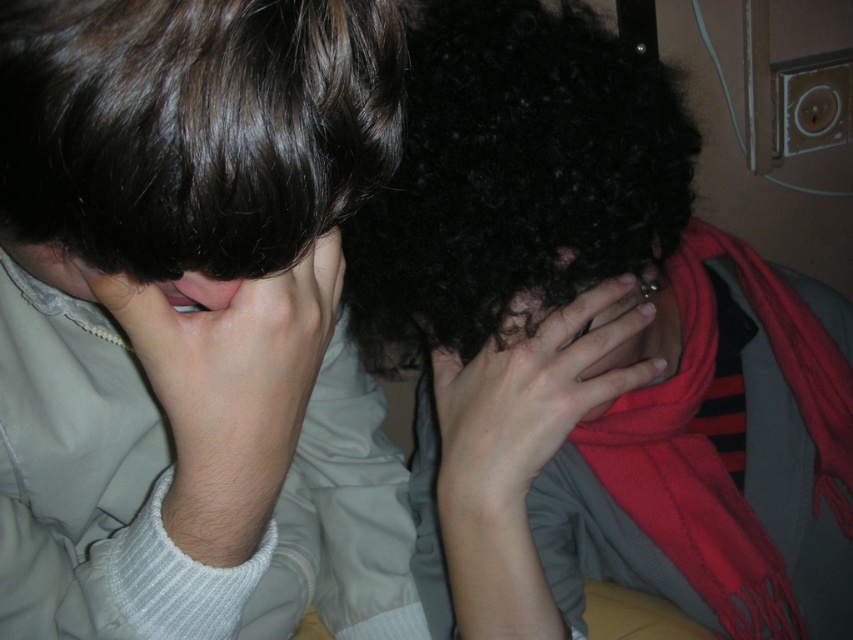
You are a tailor measuring clothing for two people in the scene. You need to determine which object is wider to decide which requires more fabric. Which is wider, the smooth beige shirt at left or the black curly hair at upper center?

The smooth beige shirt at left is wider than the black curly hair at upper center, so it requires more fabric.

You are a photographer standing at the camera position. You want to take a photo of the two people in the scene. The focus point of your camera is set to point (x=451, y=310). Is this point within the depth of field range of 18 to 22 inches?

The distance of point (x=451, y=310) from the camera is 19.87 inches, which falls within the depth of field range of 18 to 22 inches. Therefore, the focus point is within the required range.